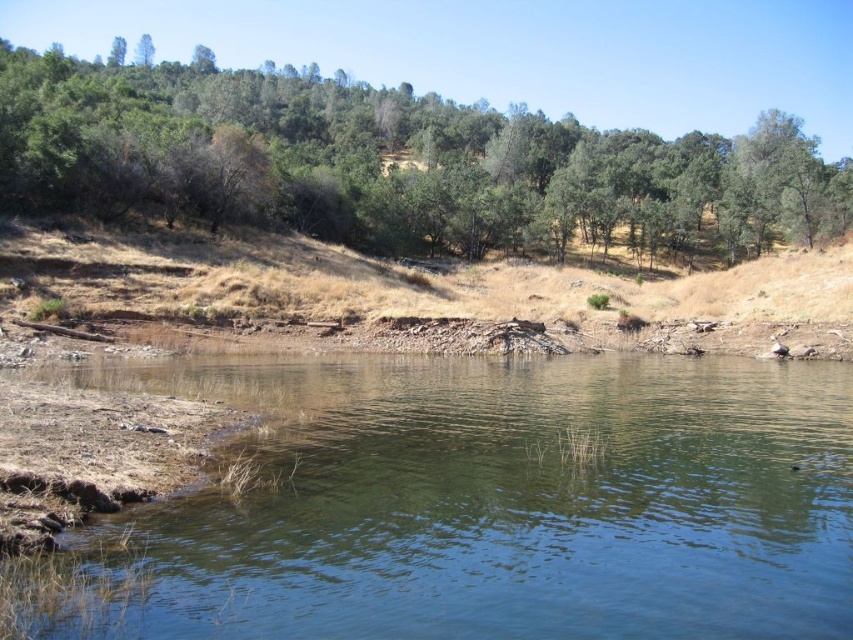
You are a hiker standing at the edge of the brown dirt at center and looking towards the green leafy tree at upper center. Which direction should you walk to reach the tree?

The green leafy tree at upper center is above the brown dirt at center, so you should walk upwards in the direction of the tree to reach it.

You are standing at the point closer to the camera between the two points, point (372, 132) and point (68, 292). Which point are you standing at?

You are standing at point (372, 132) because it is further to the camera than point (68, 292). Since you are at the point closer to the camera, the correct point is point (372, 132).

You are a hiker who wants to cross the clear water at center and brown dirt at center. Which path is wider so you can walk through easily?

The brown dirt at center is wider than the clear water at center, so you can walk through the brown dirt at center more easily.